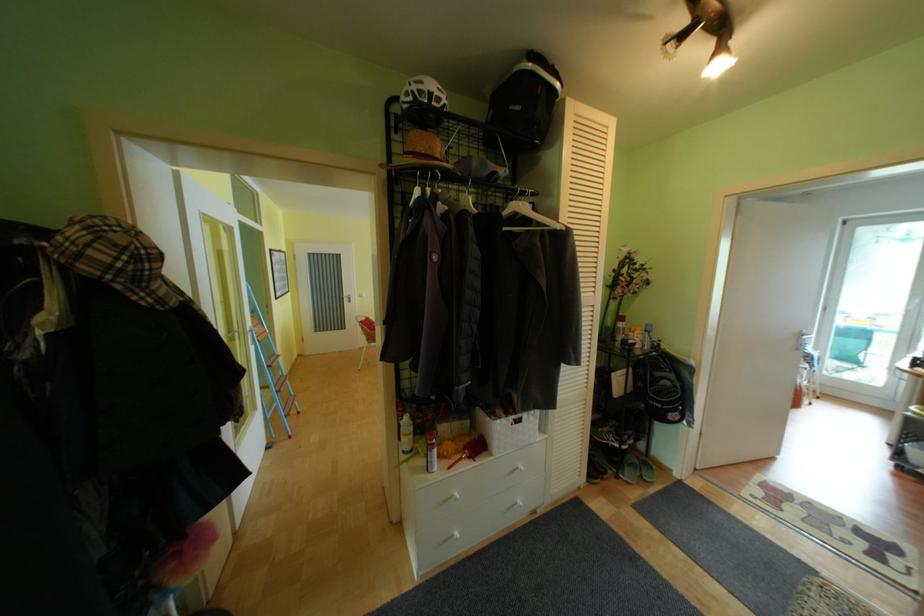
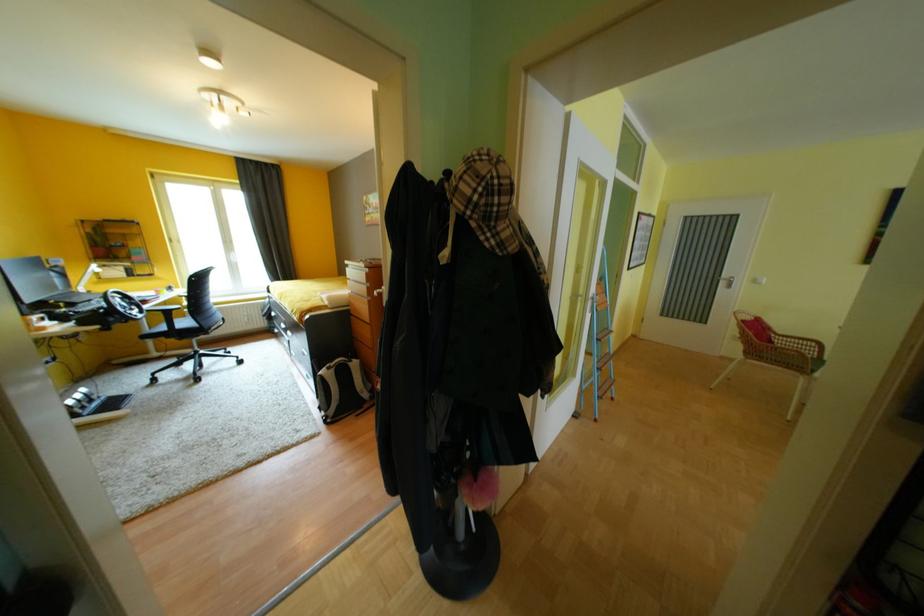
Question: The images are taken continuously from a first-person perspective. In which direction is your viewpoint rotating?

Choices:
 (A) Left
 (B) Right
 (C) Up
 (D) Down

Answer: (A)